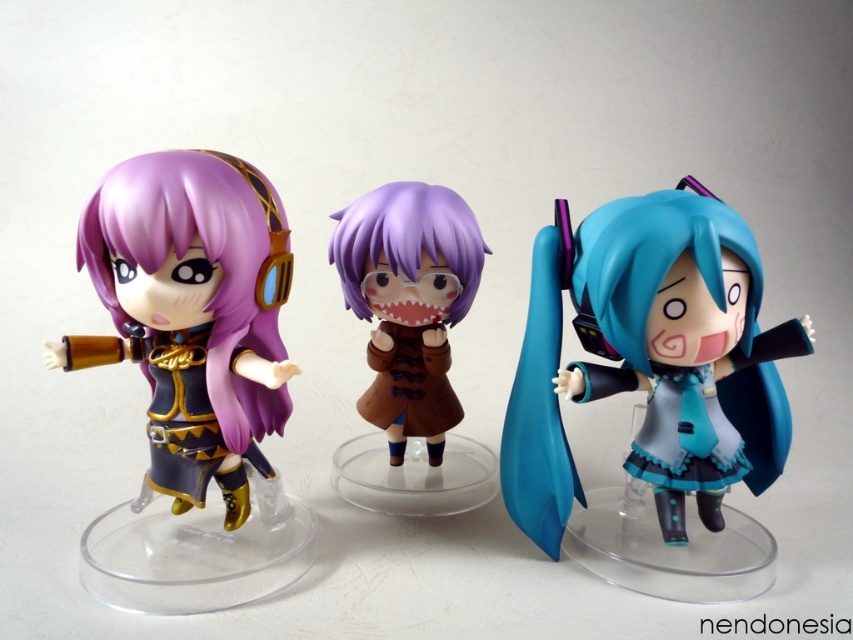
Question: Which object is positioned closest to the matte purple doll at left?

Choices:
 (A) teal glossy figure at center
 (B) purple glossy doll at center

Answer: (B)

Question: Which object is farther from the camera taking this photo?

Choices:
 (A) matte purple doll at left
 (B) purple glossy doll at center
 (C) teal glossy figure at center

Answer: (B)

Question: Does teal glossy figure at center lie in front of purple glossy doll at center?

Choices:
 (A) no
 (B) yes

Answer: (B)

Question: Can you confirm if teal glossy figure at center is positioned below matte purple doll at left?

Choices:
 (A) yes
 (B) no

Answer: (A)

Question: Which object is positioned closest to the matte purple doll at left?

Choices:
 (A) purple glossy doll at center
 (B) teal glossy figure at center

Answer: (A)

Question: Can you confirm if teal glossy figure at center is smaller than matte purple doll at left?

Choices:
 (A) no
 (B) yes

Answer: (A)